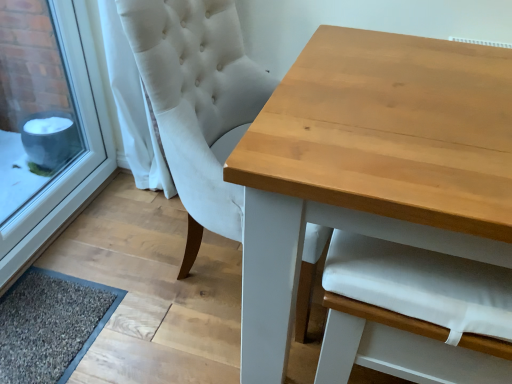
Question: Is white fabric armchair at center to the left or to the right of dark gray textured mat at lower left in the image?

Choices:
 (A) left
 (B) right

Answer: (B)

Question: From the image's perspective, relative to dark gray textured mat at lower left, is white fabric armchair at center above or below?

Choices:
 (A) above
 (B) below

Answer: (A)

Question: Based on their relative distances, which object is farther from the dark gray textured mat at lower left?

Choices:
 (A) white fabric curtain at left
 (B) light brown wooden table at center
 (C) white fabric armchair at center
 (D) white plastic window frame at lower left
 (E) white fabric chair at upper center

Answer: (C)

Question: Based on their relative distances, which object is farther from the dark gray textured mat at lower left?

Choices:
 (A) white fabric chair at upper center
 (B) white fabric curtain at left
 (C) light brown wooden table at center
 (D) white plastic window frame at lower left
 (E) white fabric armchair at center

Answer: (E)